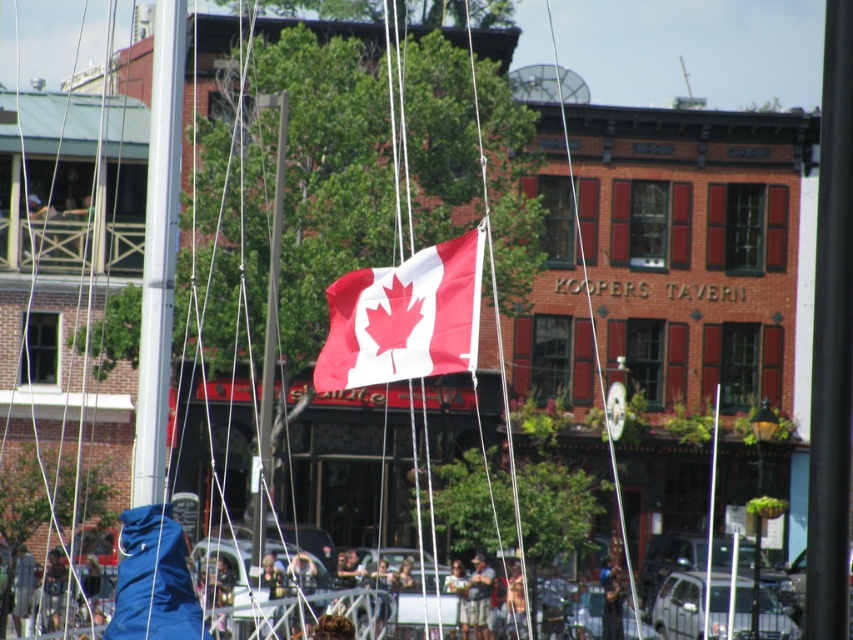
Question: Where is polyester canadian flag at center located in relation to metallic silver pole at center in the image?

Choices:
 (A) right
 (B) left

Answer: (B)

Question: Which point appears farthest from the camera in this image?

Choices:
 (A) (456, 266)
 (B) (718, 406)

Answer: (B)

Question: Can you confirm if polyester canadian flag at center is smaller than metallic silver pole at center?

Choices:
 (A) yes
 (B) no

Answer: (A)

Question: Is polyester canadian flag at center closer to the viewer compared to metallic silver pole at center?

Choices:
 (A) no
 (B) yes

Answer: (B)